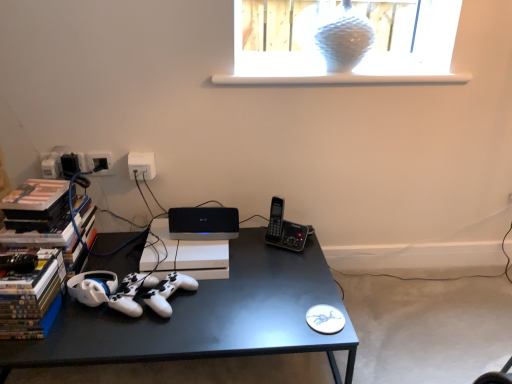
Question: Is white matte game controller at center completely or partially inside hardcover books at left?

Choices:
 (A) no
 (B) yes

Answer: (A)

Question: Is hardcover books at left outside of white matte game controller at center?

Choices:
 (A) yes
 (B) no

Answer: (A)

Question: Does hardcover books at left have a larger size compared to white matte game controller at center?

Choices:
 (A) yes
 (B) no

Answer: (A)

Question: From the image's perspective, does hardcover books at left appear higher than white matte game controller at center?

Choices:
 (A) no
 (B) yes

Answer: (B)

Question: Is hardcover books at left not near white matte game controller at center?

Choices:
 (A) yes
 (B) no

Answer: (B)

Question: From a real-world perspective, is black plastic phone at right physically located above or below transparent textured glass vase at upper center?

Choices:
 (A) above
 (B) below

Answer: (B)

Question: From the image's perspective, is black plastic phone at right positioned above or below transparent textured glass vase at upper center?

Choices:
 (A) above
 (B) below

Answer: (B)

Question: Does point (285, 236) appear closer or farther from the camera than point (337, 57)?

Choices:
 (A) closer
 (B) farther

Answer: (B)

Question: Looking at the image, does black plastic phone at right seem bigger or smaller compared to transparent textured glass vase at upper center?

Choices:
 (A) small
 (B) big

Answer: (A)

Question: Considering the positions of point (337, 74) and point (338, 24), is point (337, 74) closer or farther from the camera than point (338, 24)?

Choices:
 (A) farther
 (B) closer

Answer: (A)

Question: Choose the correct answer: Is white matte window sill at upper center inside transparent textured glass vase at upper center or outside it?

Choices:
 (A) outside
 (B) inside

Answer: (A)

Question: From a real-world perspective, is white matte window sill at upper center physically located above or below transparent textured glass vase at upper center?

Choices:
 (A) above
 (B) below

Answer: (B)

Question: From the image's perspective, is white matte window sill at upper center positioned above or below transparent textured glass vase at upper center?

Choices:
 (A) above
 (B) below

Answer: (B)

Question: Looking at their shapes, would you say black plastic phone at right is wider or thinner than white plastic electrical outlet at upper center?

Choices:
 (A) thin
 (B) wide

Answer: (B)

Question: In the image, is black plastic phone at right on the left side or the right side of white plastic electrical outlet at upper center?

Choices:
 (A) left
 (B) right

Answer: (B)